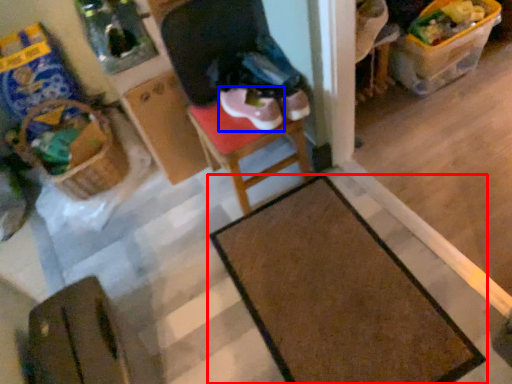
Question: Which object is further to the camera taking this photo, table (highlighted by a red box) or footwear (highlighted by a blue box)?

Choices:
 (A) table
 (B) footwear

Answer: (B)